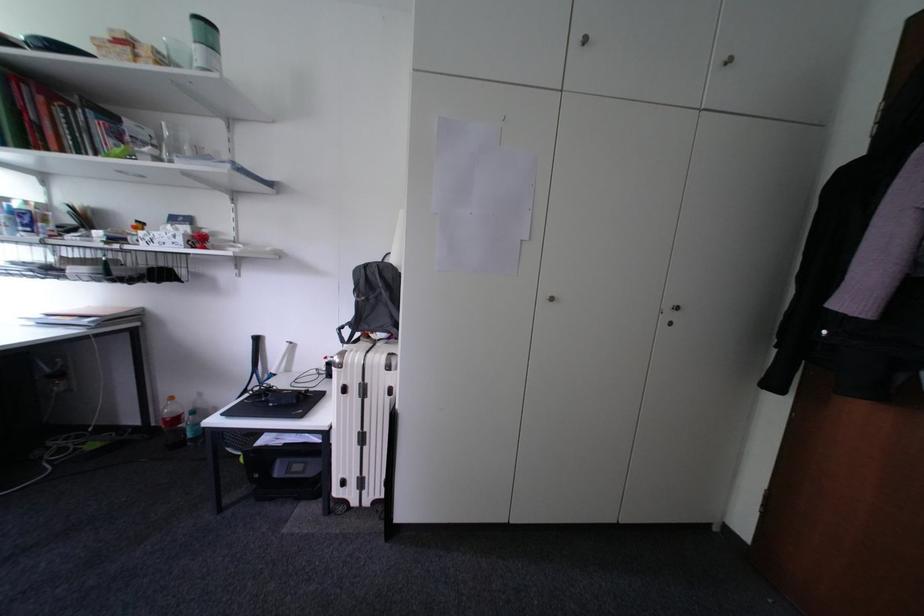
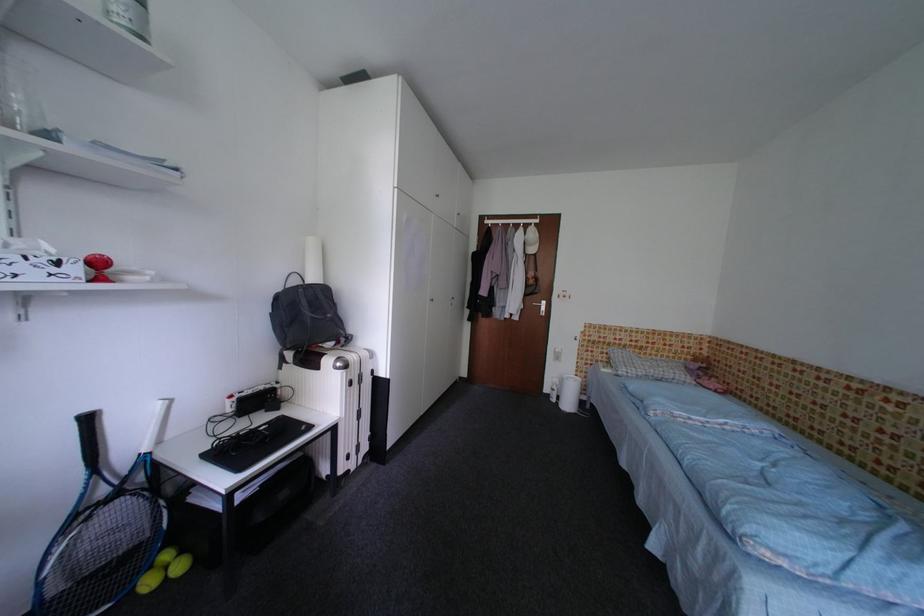
Find the pixel in the second image that matches [188,243] in the first image.

(83, 272)